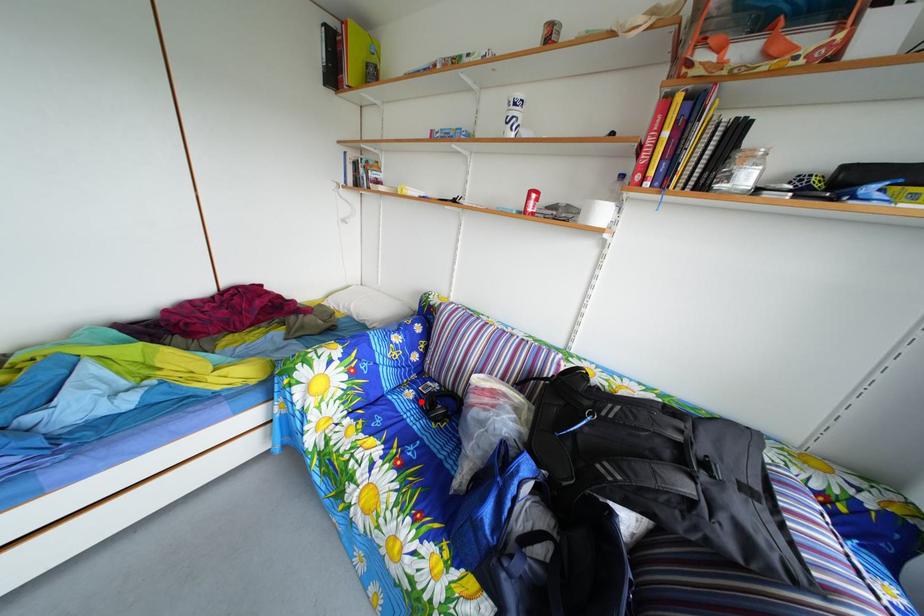
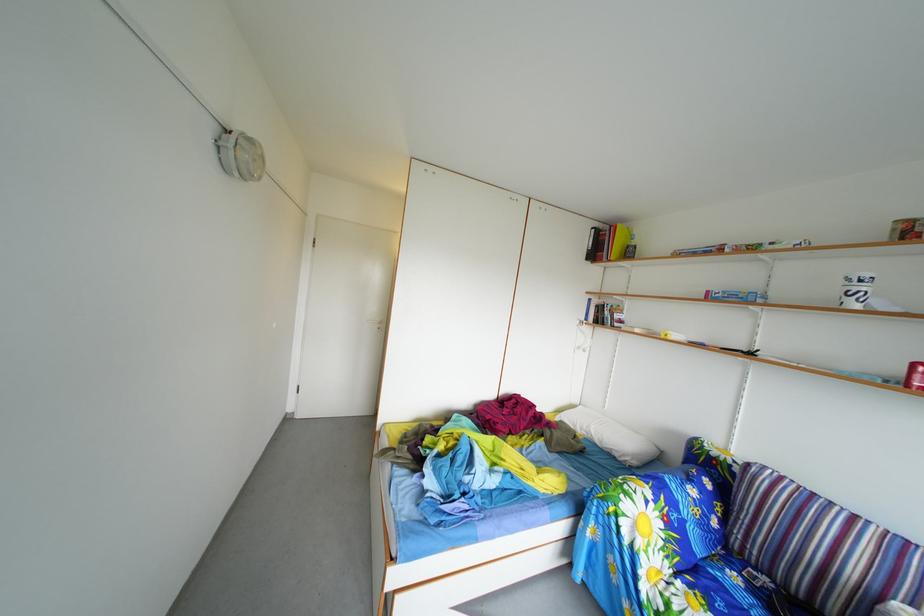
Where in the second image is the point corresponding to the highlighted location from the first image?

(746, 585)